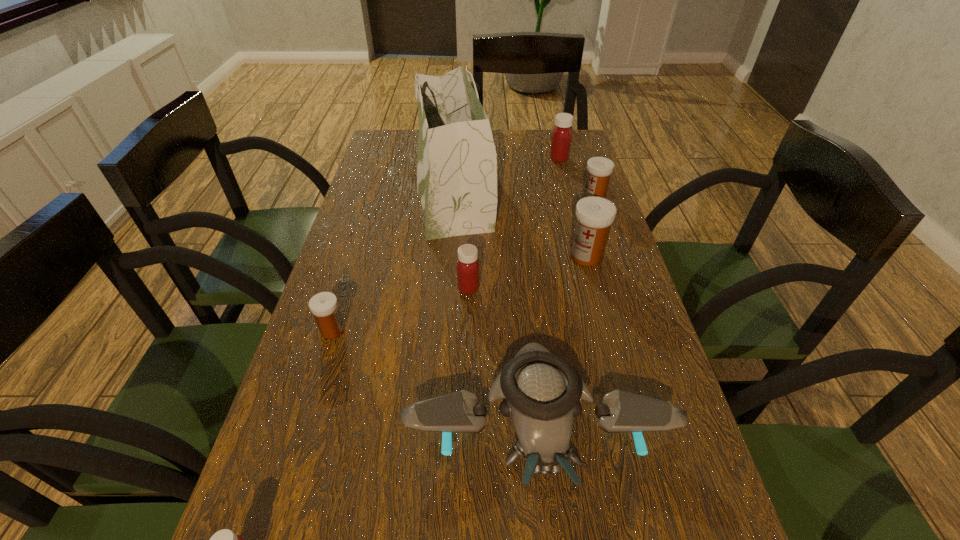
What are the coordinates of `free location at the far left corner` in the screenshot? It's located at (377, 150).

You are a GUI agent. You are given a task and a screenshot of the screen. Output one action in this format:
    pyautogui.click(x=<x>, y=<y>)
    Task: Click on the empty space that is in between the tallest object and the rightmost red medicine
    The image size is (960, 540).
    Given the screenshot: What is the action you would take?
    click(506, 174)

Locate an element on the screen. empty space between the rightmost red medicine and the second biggest red medicine is located at coordinates (514, 224).

Locate an element on the screen. The image size is (960, 540). vacant space that's between the green grocery bag and the drone is located at coordinates (496, 304).

The height and width of the screenshot is (540, 960). Find the location of `free spot between the second smallest white medicine and the fourth medicine from right to left`. free spot between the second smallest white medicine and the fourth medicine from right to left is located at coordinates (531, 244).

Find the location of a particular element. unoccupied area between the fourth medicine from right to left and the tallest object is located at coordinates (461, 238).

The image size is (960, 540). I want to click on free point between the farthest medicine and the drone, so click(548, 289).

I want to click on vacant space that's between the biggest white medicine and the fifth farthest medicine, so click(x=460, y=293).

Locate an element on the screen. vacant area between the green grocery bag and the drone is located at coordinates (496, 304).

Find the location of `free space between the second farthest medicine and the third medicine from left to right`. free space between the second farthest medicine and the third medicine from left to right is located at coordinates (531, 244).